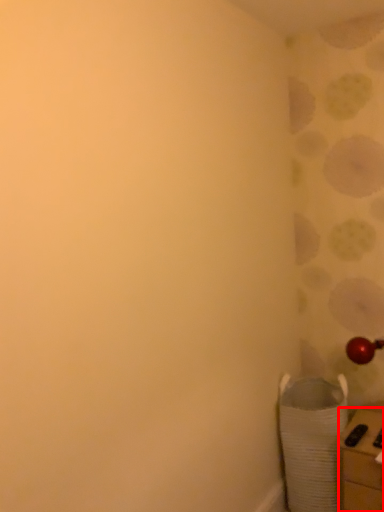
Question: From the image's perspective, where is furniture (annotated by the red box) located relative to laundry basket?

Choices:
 (A) below
 (B) above

Answer: (A)